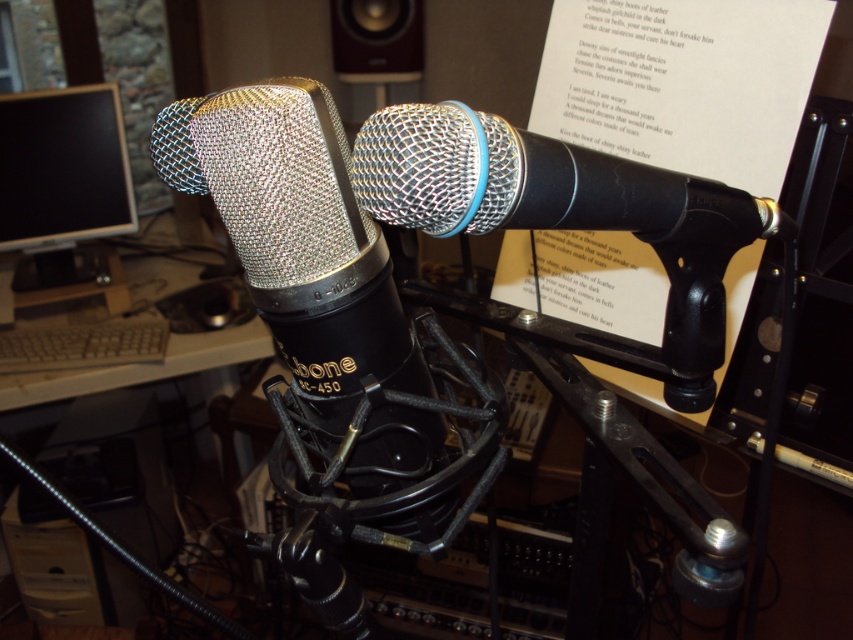
Where is `metallic silver computer desk at center`? The image size is (853, 640). metallic silver computer desk at center is located at coordinates (141, 365).

Who is positioned more to the left, metallic silver computer desk at center or gray plastic keyboard at lower left?

gray plastic keyboard at lower left is more to the left.

At what (x,y) coordinates should I click in order to perform the action: click on metallic silver computer desk at center. Please return your answer as a coordinate pair (x, y). This screenshot has width=853, height=640. Looking at the image, I should click on (141, 365).

The image size is (853, 640). Identify the location of metallic silver computer desk at center. (141, 365).

In the scene shown: Does matte silver mesh microphone at center have a smaller size compared to silver mesh microphone at center?

Incorrect, matte silver mesh microphone at center is not smaller in size than silver mesh microphone at center.

Describe the element at coordinates (294, 228) in the screenshot. This screenshot has height=640, width=853. I see `matte silver mesh microphone at center` at that location.

The width and height of the screenshot is (853, 640). In order to click on matte silver mesh microphone at center in this screenshot , I will do `click(294, 228)`.

Does matte silver mesh microphone at center appear on the left side of matte brown speaker at upper center?

Incorrect, matte silver mesh microphone at center is not on the left side of matte brown speaker at upper center.

Who is higher up, matte silver mesh microphone at center or matte brown speaker at upper center?

matte brown speaker at upper center is higher up.

What do you see at coordinates (294, 228) in the screenshot?
I see `matte silver mesh microphone at center` at bounding box center [294, 228].

This screenshot has height=640, width=853. Identify the location of matte silver mesh microphone at center. (294, 228).